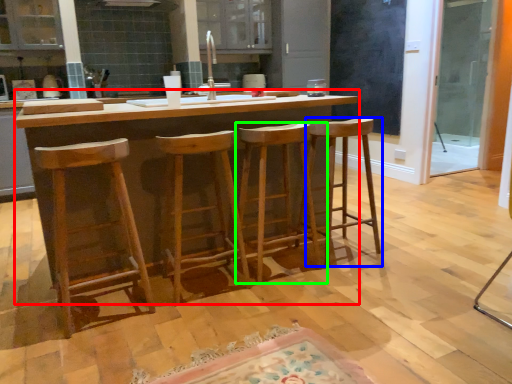
Question: Considering the real-world distances, which object is farthest from table (highlighted by a red box)? stool (highlighted by a blue box) or stool (highlighted by a green box)?

Choices:
 (A) stool
 (B) stool

Answer: (A)